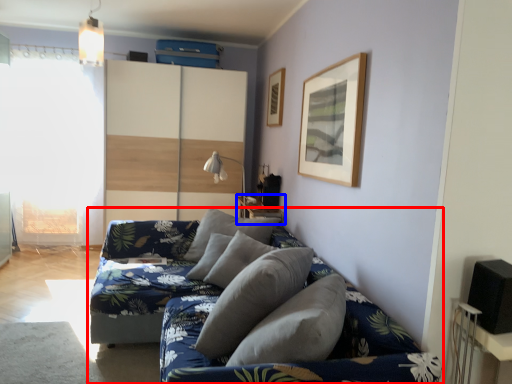
Question: Among these objects, which one is farthest to the camera, studio couch (highlighted by a red box) or table (highlighted by a blue box)?

Choices:
 (A) studio couch
 (B) table

Answer: (B)